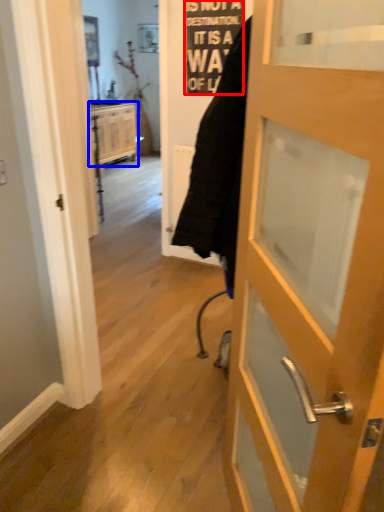
Question: Which object is closer to the camera taking this photo, writing (highlighted by a red box) or cabinetry (highlighted by a blue box)?

Choices:
 (A) writing
 (B) cabinetry

Answer: (A)